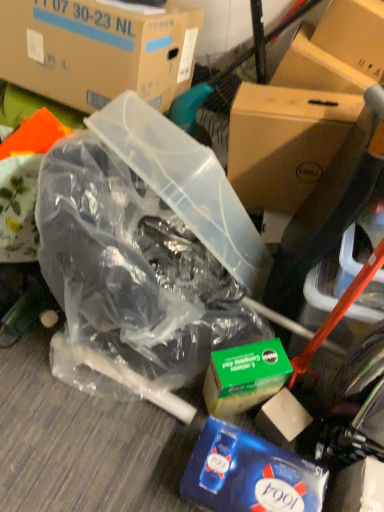
Question: Is transparent plastic bag at center oriented away from brown cardboard box at upper right, the first box positioned from the right?

Choices:
 (A) yes
 (B) no

Answer: (A)

Question: Can you confirm if transparent plastic bag at center is positioned to the right of brown cardboard box at upper right, the first box positioned from the right?

Choices:
 (A) no
 (B) yes

Answer: (A)

Question: Can you confirm if transparent plastic bag at center is smaller than brown cardboard box at upper right, the first box positioned from the right?

Choices:
 (A) no
 (B) yes

Answer: (A)

Question: Does transparent plastic bag at center have a greater height compared to brown cardboard box at upper right, positioned as the 2th box in left-to-right order?

Choices:
 (A) yes
 (B) no

Answer: (A)

Question: From the image's perspective, does transparent plastic bag at center appear lower than brown cardboard box at upper right, positioned as the 2th box in left-to-right order?

Choices:
 (A) no
 (B) yes

Answer: (B)

Question: Is transparent plastic bag at center not close to brown cardboard box at upper right, positioned as the 2th box in left-to-right order?

Choices:
 (A) yes
 (B) no

Answer: (B)

Question: From a real-world perspective, is blue glossy tissue box at lower right located higher than green cardboard box at center?

Choices:
 (A) no
 (B) yes

Answer: (A)

Question: From the image's perspective, does blue glossy tissue box at lower right appear higher than green cardboard box at center?

Choices:
 (A) yes
 (B) no

Answer: (B)

Question: Considering the relative sizes of blue glossy tissue box at lower right and green cardboard box at center in the image provided, is blue glossy tissue box at lower right taller than green cardboard box at center?

Choices:
 (A) no
 (B) yes

Answer: (A)

Question: Does blue glossy tissue box at lower right appear on the left side of green cardboard box at center?

Choices:
 (A) yes
 (B) no

Answer: (B)

Question: Considering the relative sizes of blue glossy tissue box at lower right and green cardboard box at center in the image provided, is blue glossy tissue box at lower right thinner than green cardboard box at center?

Choices:
 (A) yes
 (B) no

Answer: (B)

Question: Is blue glossy tissue box at lower right next to green cardboard box at center and touching it?

Choices:
 (A) yes
 (B) no

Answer: (B)

Question: Is transparent plastic bag at center positioned in front of blue glossy tissue box at lower right?

Choices:
 (A) no
 (B) yes

Answer: (B)